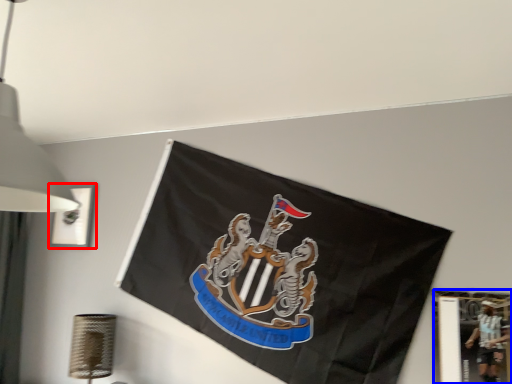
Question: Which object is further to the camera taking this photo, picture frame (highlighted by a red box) or picture frame (highlighted by a blue box)?

Choices:
 (A) picture frame
 (B) picture frame

Answer: (A)